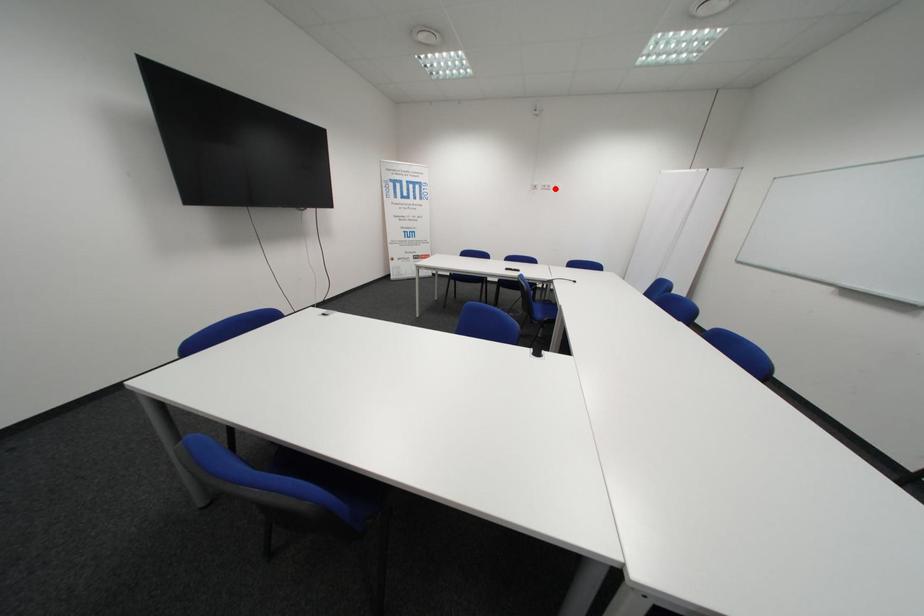
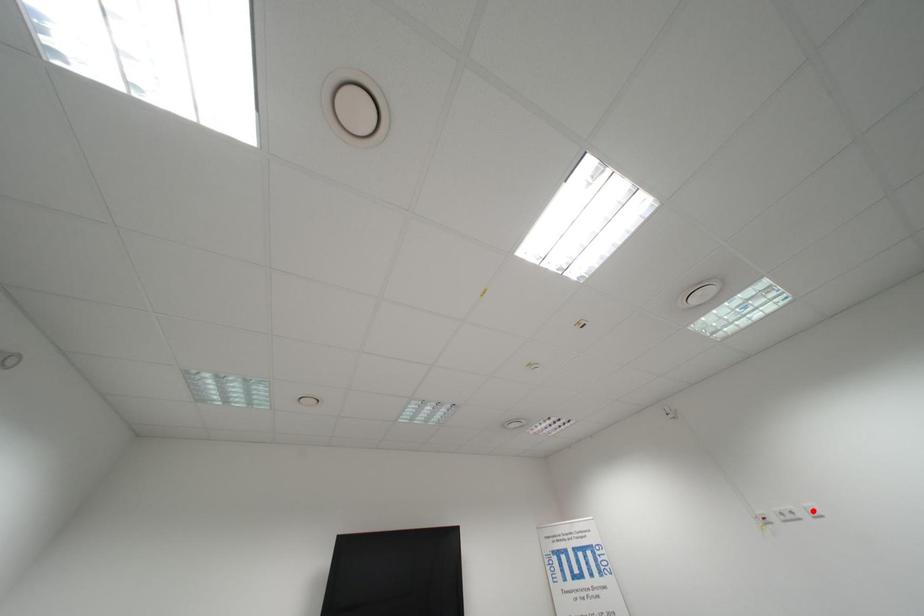
I am providing you with two images of the same scene from different viewpoints. A red point is marked on the first image and another point is marked on the second image. Does the point marked in image1 correspond to the same location as the one in image2?

No